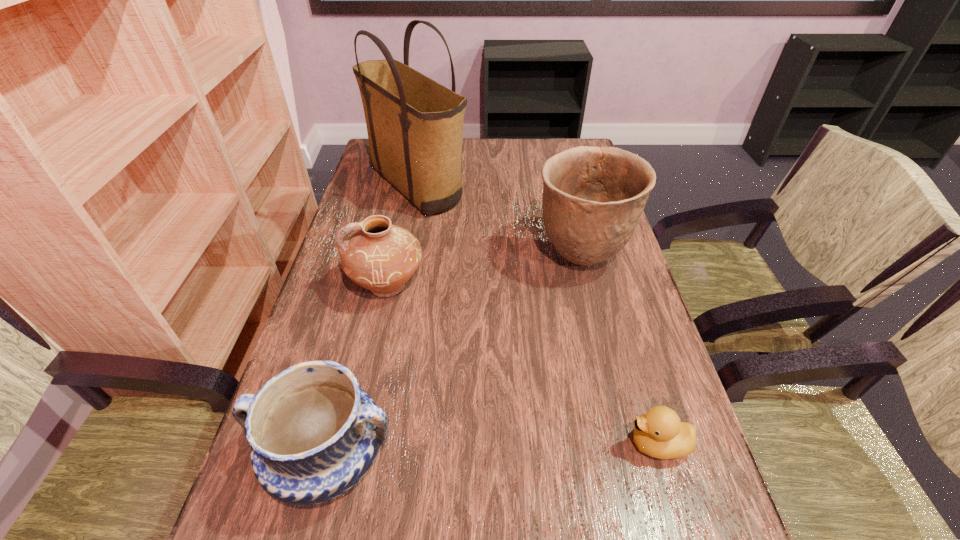
Where is `the farthest object`? The image size is (960, 540). the farthest object is located at coordinates (415, 125).

The width and height of the screenshot is (960, 540). I want to click on the tallest object, so click(415, 125).

Where is `the second tallest object`? The image size is (960, 540). the second tallest object is located at coordinates (593, 197).

In order to click on the tallest pottery in this screenshot , I will do `click(593, 197)`.

This screenshot has height=540, width=960. Identify the location of the nearest pottery. (314, 433).

Find the location of a particular element. The image size is (960, 540). duckling is located at coordinates (659, 433).

The image size is (960, 540). I want to click on blank space located 0.230m on the front of the tallest object, so click(x=399, y=281).

This screenshot has height=540, width=960. I want to click on free space located on the back of the rightmost pottery, so click(563, 186).

This screenshot has height=540, width=960. I want to click on vacant space located on the right of the nearest pottery, so click(535, 457).

Where is `free spot located 0.340m on the face of the shortest object`? This screenshot has height=540, width=960. free spot located 0.340m on the face of the shortest object is located at coordinates (437, 444).